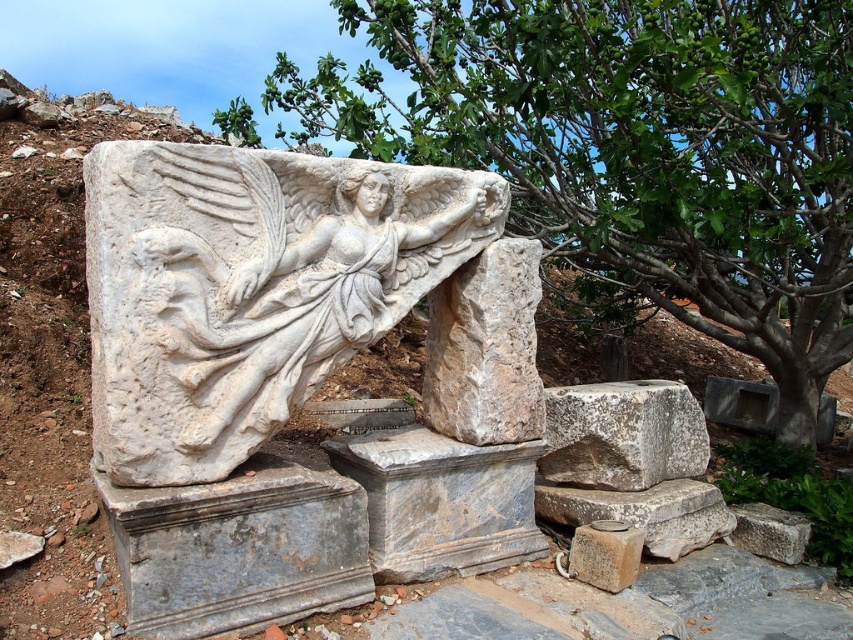
You are standing in front of the ancient stone sculpture. There is a gray rough stone marked at point (622, 435). Can you tell me the exact coordinates of the gray rough stone?

The gray rough stone at center is represented by point (622, 435).